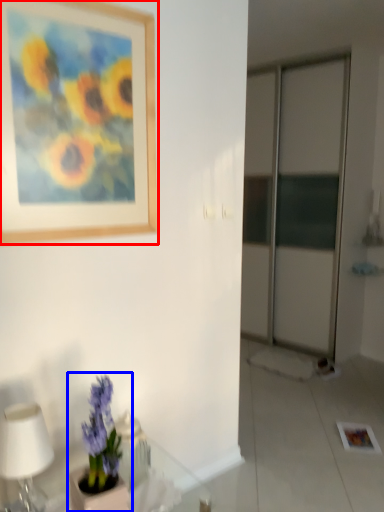
Question: Which object appears closest to the camera in this image, picture frame (highlighted by a red box) or houseplant (highlighted by a blue box)?

Choices:
 (A) picture frame
 (B) houseplant

Answer: (B)